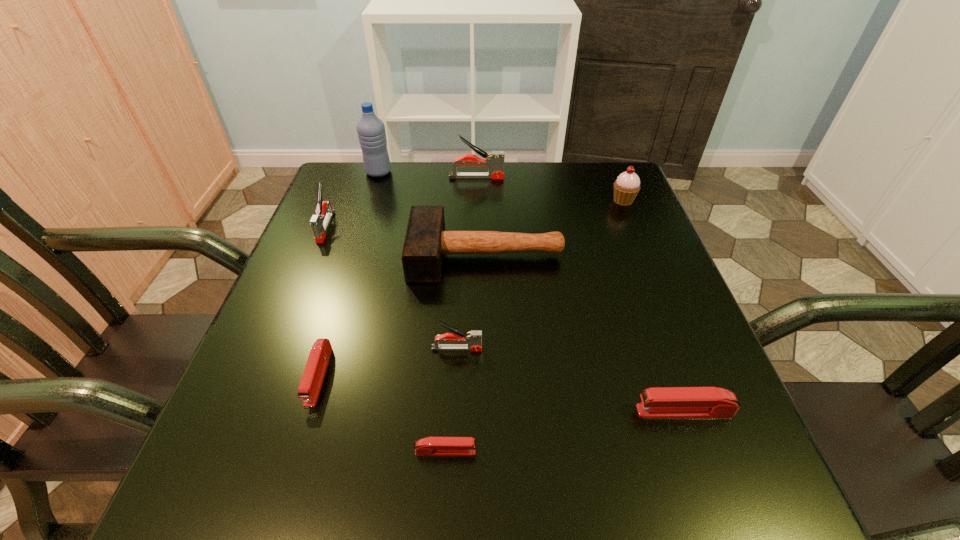
Where is `the tallest object`? the tallest object is located at coordinates (371, 131).

At what (x,y) coordinates should I click in order to perform the action: click on water bottle. Please return your answer as a coordinate pair (x, y). Looking at the image, I should click on (371, 131).

Where is `the second tallest object`? the second tallest object is located at coordinates (494, 161).

Identify the location of the tallest stapler. (494, 161).

Where is `the second biggest gray stapler`? The width and height of the screenshot is (960, 540). the second biggest gray stapler is located at coordinates (319, 223).

This screenshot has height=540, width=960. In order to click on the second nearest gray stapler in this screenshot , I will do `click(319, 223)`.

At what (x,y) coordinates should I click in order to perform the action: click on cupcake. Please return your answer as a coordinate pair (x, y). The image size is (960, 540). Looking at the image, I should click on (626, 187).

Image resolution: width=960 pixels, height=540 pixels. I want to click on the fourth shortest stapler, so click(474, 338).

Find the location of a particular element. This screenshot has width=960, height=540. the nearest gray stapler is located at coordinates (474, 338).

Where is `mallet`? mallet is located at coordinates (426, 240).